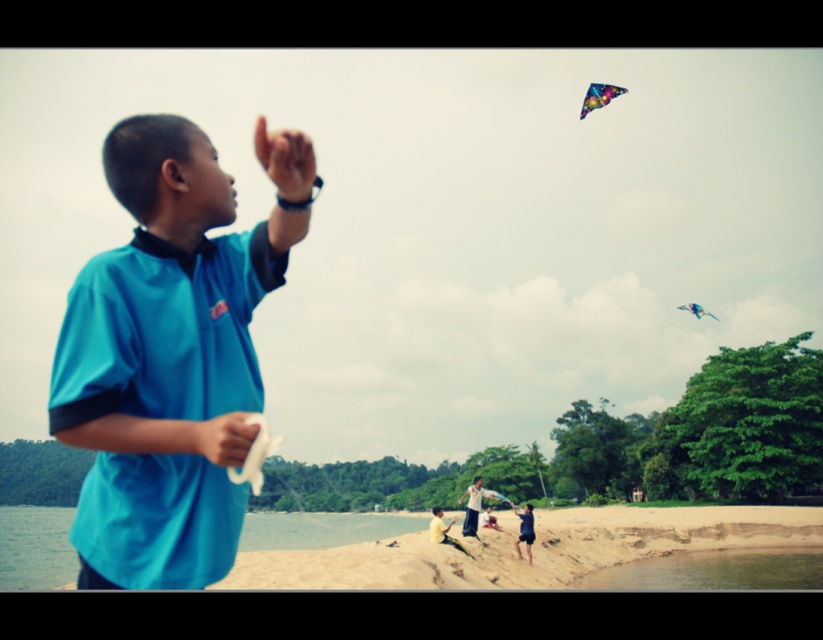
Question: Estimate the real-world distances between objects in this image. Which object is farther from the sandy beach at lower center?

Choices:
 (A) dark blue fabric pants at lower center
 (B) multicolored paper kite at upper right
 (C) teal matte shirt at center
 (D) translucent blue kite at upper right

Answer: (C)

Question: Observing the image, what is the correct spatial positioning of clear water at lower right in reference to multicolored paper kite at upper right?

Choices:
 (A) below
 (B) above

Answer: (A)

Question: Which point is closer to the camera?

Choices:
 (A) sandy beach at lower center
 (B) teal matte shirt at center
 (C) multicolored paper kite at upper right

Answer: (B)

Question: Can you confirm if teal matte shirt at center is positioned to the left of multicolored paper kite at upper right?

Choices:
 (A) no
 (B) yes

Answer: (B)

Question: Which of the following is the farthest from the observer?

Choices:
 (A) (128, 323)
 (B) (811, 554)
 (C) (266, 557)

Answer: (B)

Question: Is sandy beach at lower center bigger than translucent blue kite at upper right?

Choices:
 (A) yes
 (B) no

Answer: (A)